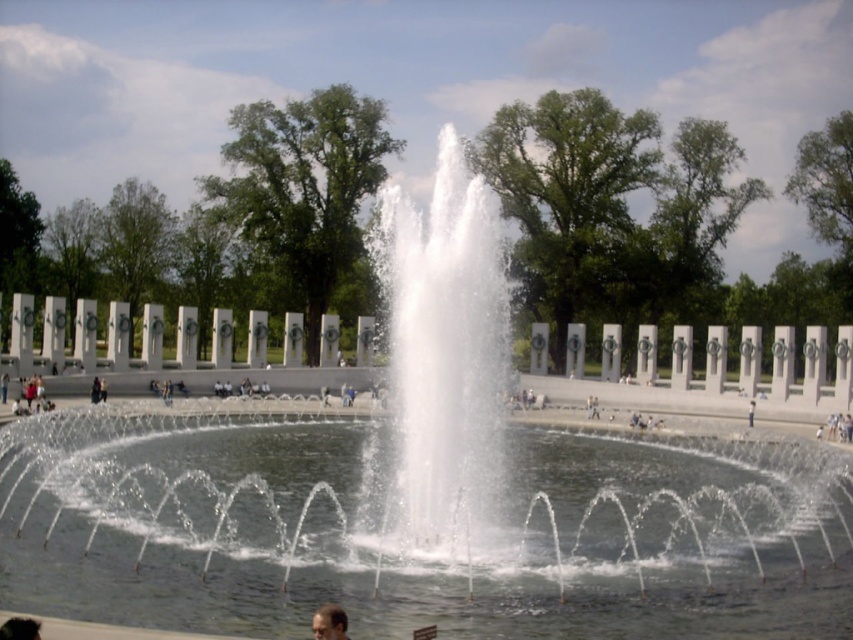
Question: Can you confirm if smooth skin face at lower center is wider than dark brown hair at lower left?

Choices:
 (A) no
 (B) yes

Answer: (B)

Question: Which of the following is the farthest from the observer?

Choices:
 (A) smooth skin face at lower center
 (B) dark brown hair at lower left

Answer: (A)

Question: Among these points, which one is farthest from the camera?

Choices:
 (A) click(312, 618)
 (B) click(13, 637)

Answer: (A)

Question: Can you confirm if smooth skin face at lower center is thinner than dark brown hair at lower left?

Choices:
 (A) yes
 (B) no

Answer: (B)

Question: Does smooth skin face at lower center come in front of dark brown hair at lower left?

Choices:
 (A) no
 (B) yes

Answer: (A)